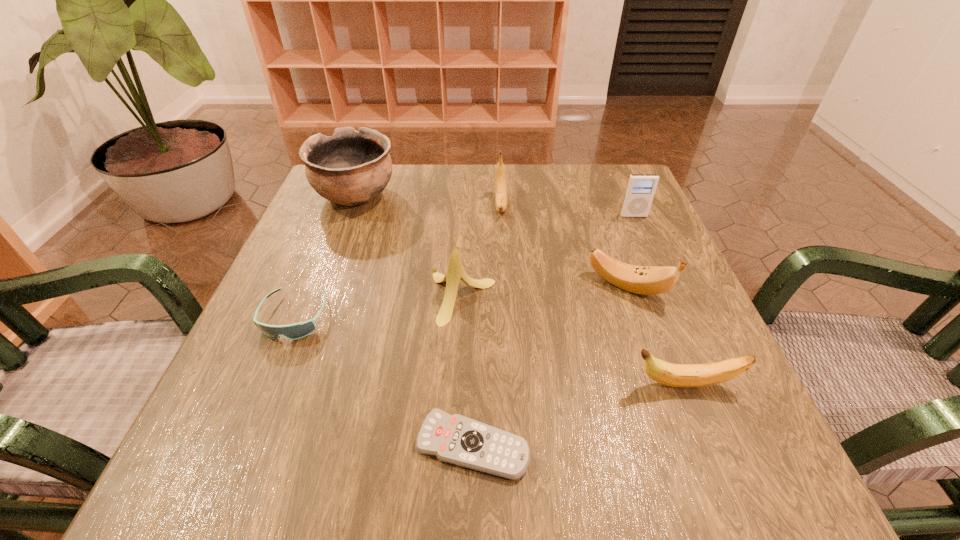
This screenshot has height=540, width=960. I want to click on pottery that is at the far edge, so click(x=349, y=168).

Locate an element on the screen. banana located in the far edge section of the desktop is located at coordinates (501, 201).

Image resolution: width=960 pixels, height=540 pixels. I want to click on iPod that is positioned at the far edge, so click(641, 188).

Find the location of `object that is at the near edge`. object that is at the near edge is located at coordinates (456, 439).

Where is `pottery that is positioned at the left edge`? The height and width of the screenshot is (540, 960). pottery that is positioned at the left edge is located at coordinates (349, 168).

Find the location of a particular element. goggles that is at the left edge is located at coordinates (299, 330).

I want to click on iPod that is at the right edge, so click(x=641, y=188).

Image resolution: width=960 pixels, height=540 pixels. Find the location of `object positioned at the far left corner`. object positioned at the far left corner is located at coordinates (349, 168).

Identify the location of object that is at the far right corner. (641, 188).

Identify the location of vacant space at the far edge. (432, 188).